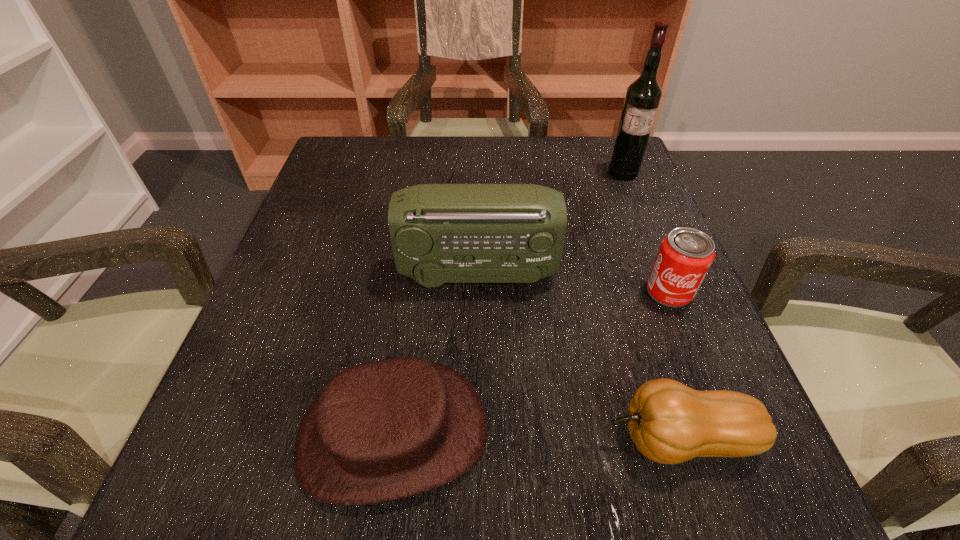
Locate an element on the screen. free space located 0.140m on the stem side of the gourd is located at coordinates (503, 439).

What are the coordinates of `vacant point located 0.350m on the stem side of the gourd` in the screenshot? It's located at (351, 439).

This screenshot has width=960, height=540. What are the coordinates of `free location located 0.130m on the back of the hat` in the screenshot? It's located at (411, 307).

This screenshot has height=540, width=960. In order to click on object at the far edge in this screenshot , I will do `click(643, 96)`.

Where is `gourd that is at the near edge`? The image size is (960, 540). gourd that is at the near edge is located at coordinates (670, 423).

Where is `hat that is at the near edge`? This screenshot has height=540, width=960. hat that is at the near edge is located at coordinates tap(384, 430).

The image size is (960, 540). Identify the location of object located in the left edge section of the desktop. (384, 430).

Find the location of `wine bottle that is at the right edge`. wine bottle that is at the right edge is located at coordinates (643, 96).

Find the location of a particular element. The image size is (960, 540). can that is positioned at the right edge is located at coordinates (685, 255).

Find the location of a particular element. Image resolution: width=960 pixels, height=540 pixels. gourd present at the right edge is located at coordinates (670, 423).